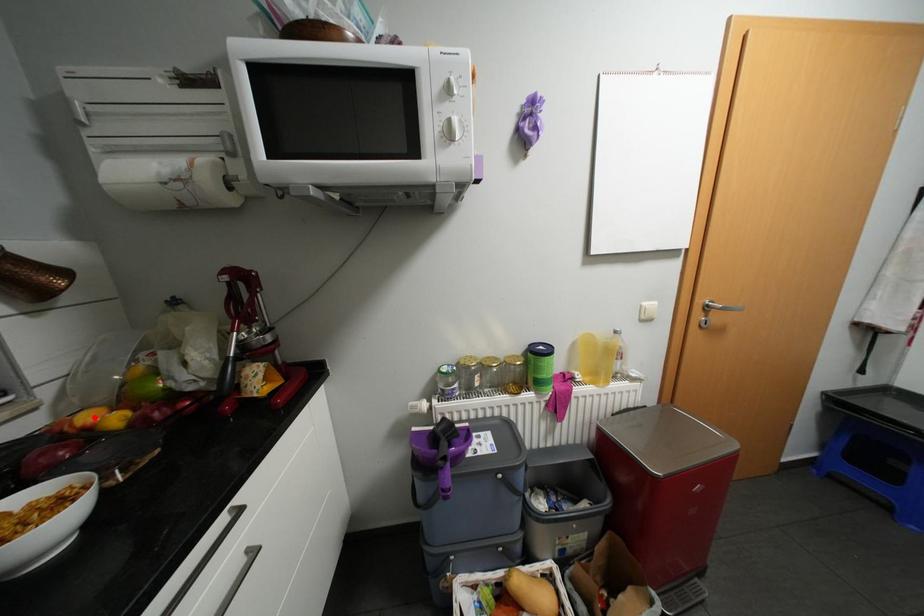
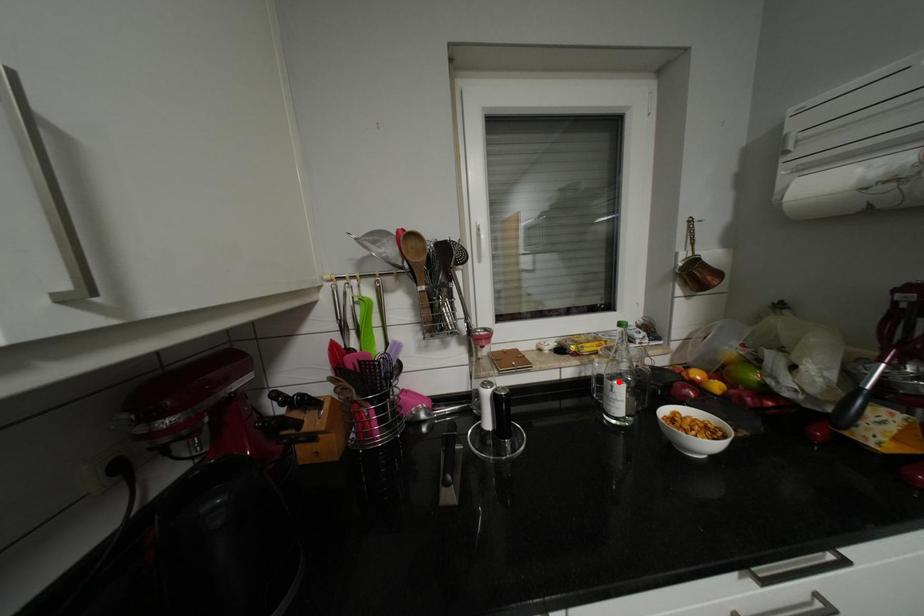
I am providing you with two images of the same scene from different viewpoints. A red point is marked on the first image and another point is marked on the second image. Are the points marked in image1 and image2 representing the same 3D position?

No